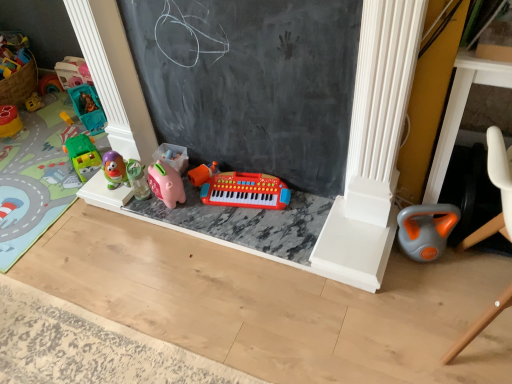
At what (x,y) coordinates should I click in order to perform the action: click on vacant area that is situated to the right of gray-orange plastic kettlebell at lower right, which ranks as the first toy in right-to-left order. Please return your answer as a coordinate pair (x, y). Looking at the image, I should click on 481,261.